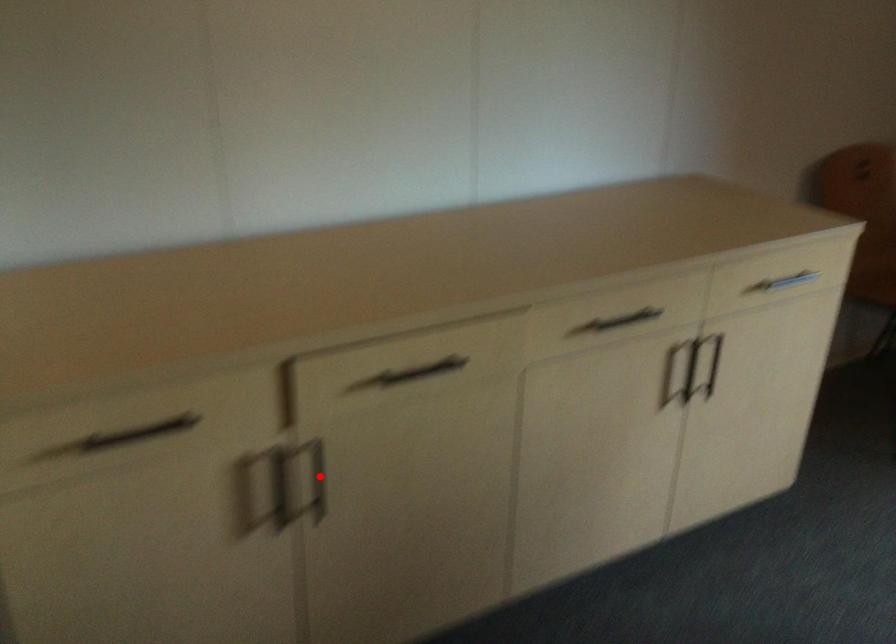
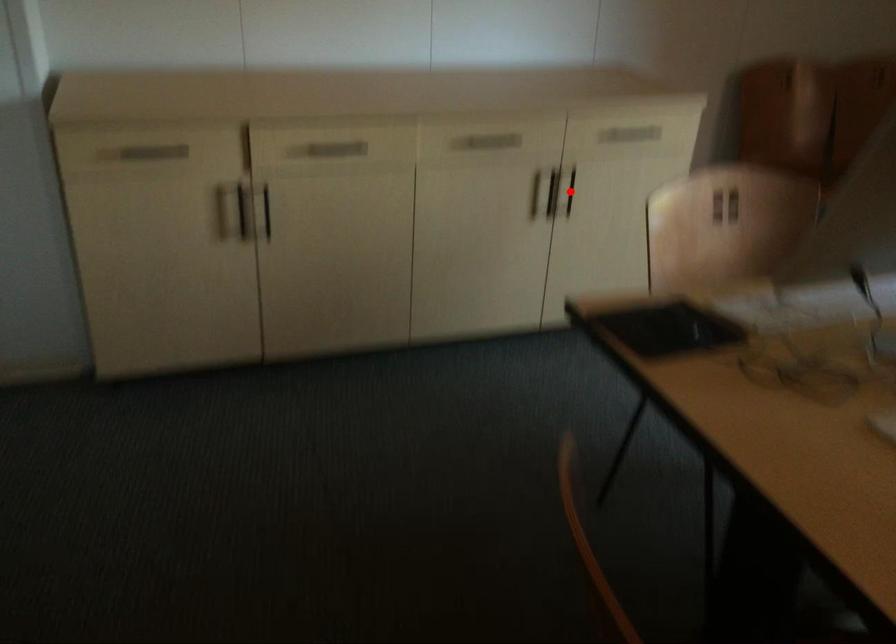
From the picture: I am providing you with two images of the same scene from different viewpoints. A red point is marked on the first image and another point is marked on the second image. Is the red point in image1 aligned with the point shown in image2?

No